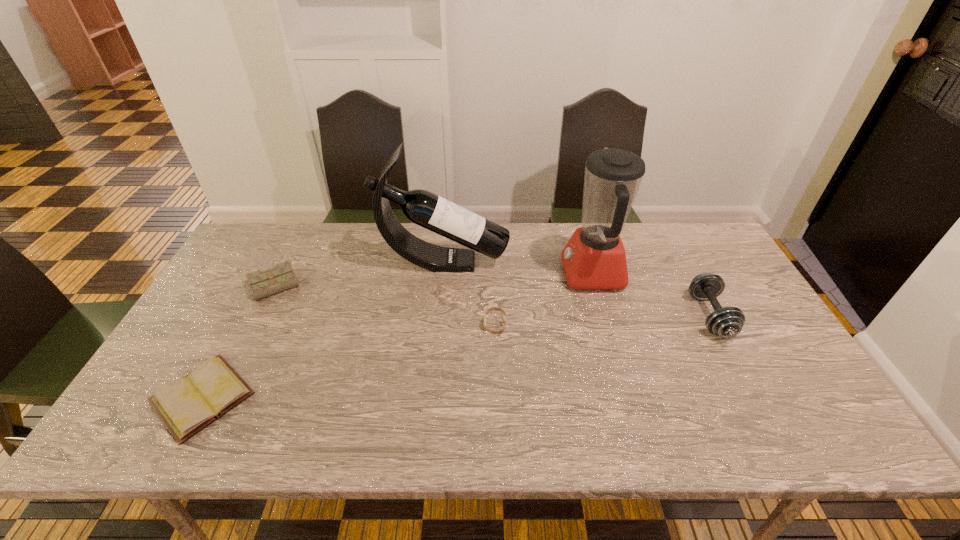
Locate an element on the screen. The height and width of the screenshot is (540, 960). vacant area situated on the front of the second object from right to left near the controls is located at coordinates click(462, 274).

Locate an element on the screen. This screenshot has width=960, height=540. free space located 0.390m on the stand of the wine bottle is located at coordinates (631, 262).

Locate an element on the screen. This screenshot has width=960, height=540. vacant space positioned on the front of the fourth shortest object is located at coordinates (758, 409).

Image resolution: width=960 pixels, height=540 pixels. In order to click on free space located 0.130m on the back of the farther diary in this screenshot , I will do `click(299, 244)`.

Locate an element on the screen. The height and width of the screenshot is (540, 960). vacant space located on the face of the watch is located at coordinates (415, 325).

Image resolution: width=960 pixels, height=540 pixels. I want to click on free space located on the face of the watch, so click(437, 325).

I want to click on free space located 0.400m on the face of the watch, so click(338, 325).

Find the location of a particular element. The image size is (960, 540). vacant space situated 0.290m on the right of the nearest object is located at coordinates (376, 397).

In order to click on blender located in the far edge section of the desktop in this screenshot , I will do `click(594, 258)`.

Where is `wine bottle at the far edge`? The height and width of the screenshot is (540, 960). wine bottle at the far edge is located at coordinates (424, 208).